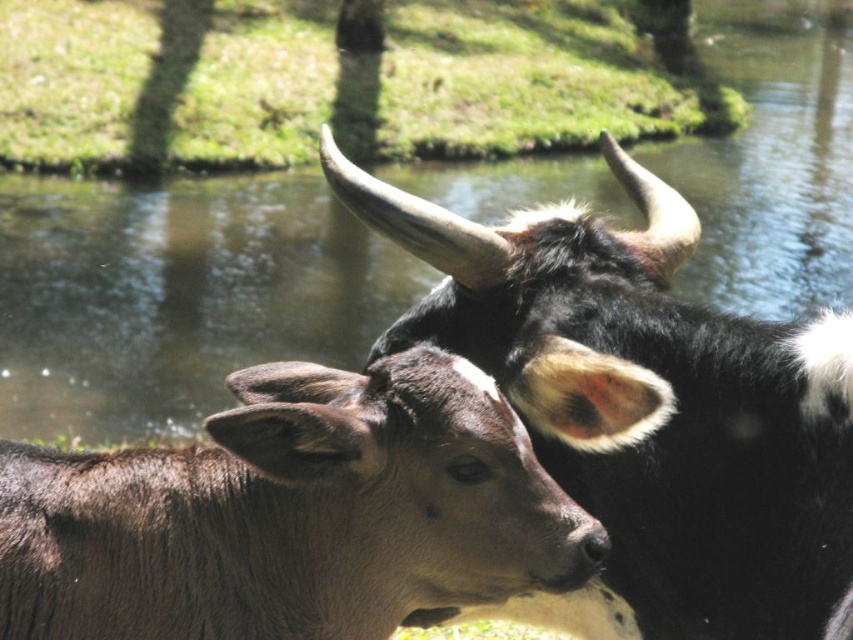
You are standing in the serene outdoor scene with two cows near a body of water. You need to locate the black glossy horned buffalo at upper center. What are its coordinates in the image?

The coordinates of the black glossy horned buffalo at upper center are at point (645, 410).

You are a farmer checking the water level in the pond. You see the brown furry buffalo at center and the green grass at upper center. Which object is shorter?

The brown furry buffalo at center is shorter than the green grass at upper center.